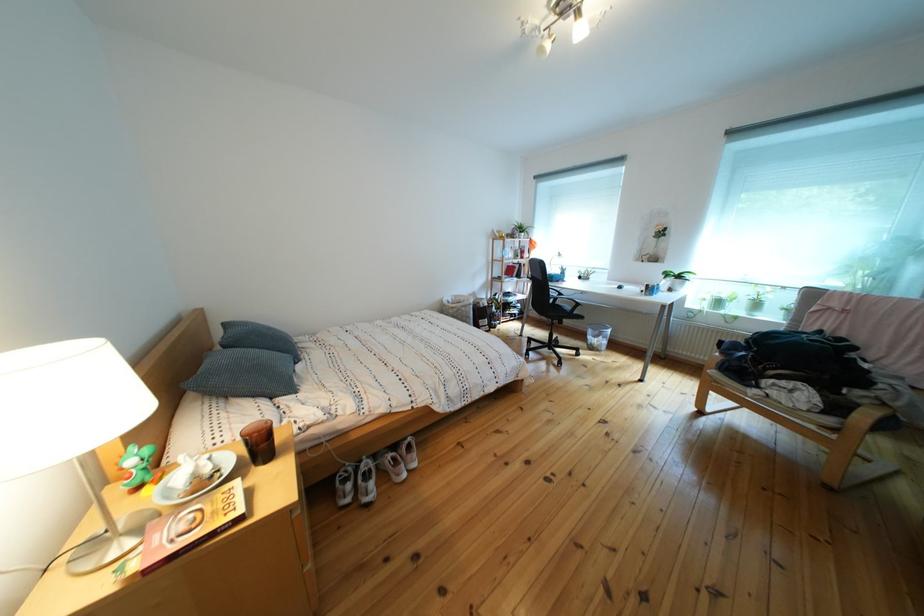
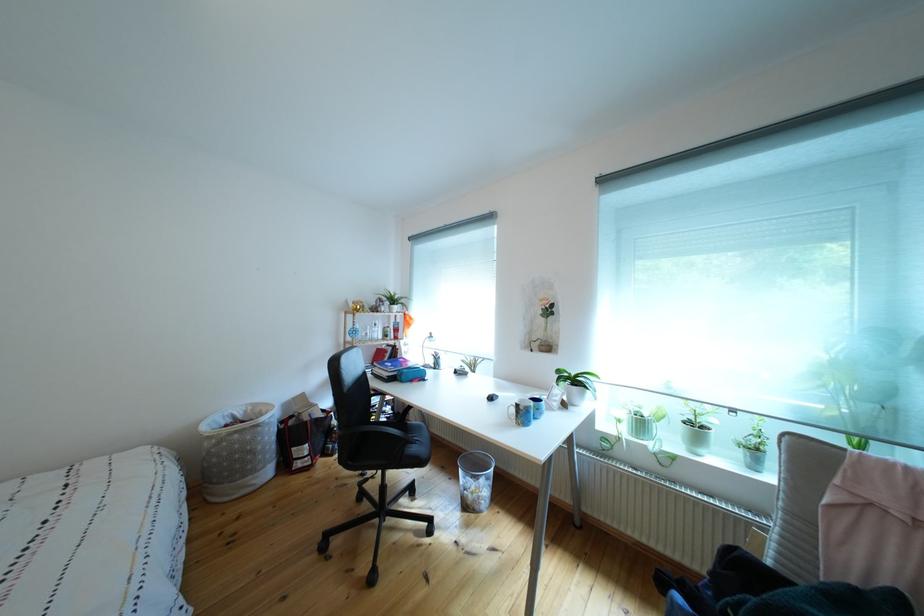
Locate, in the second image, the point that corresponds to [730,309] in the first image.

(652, 430)